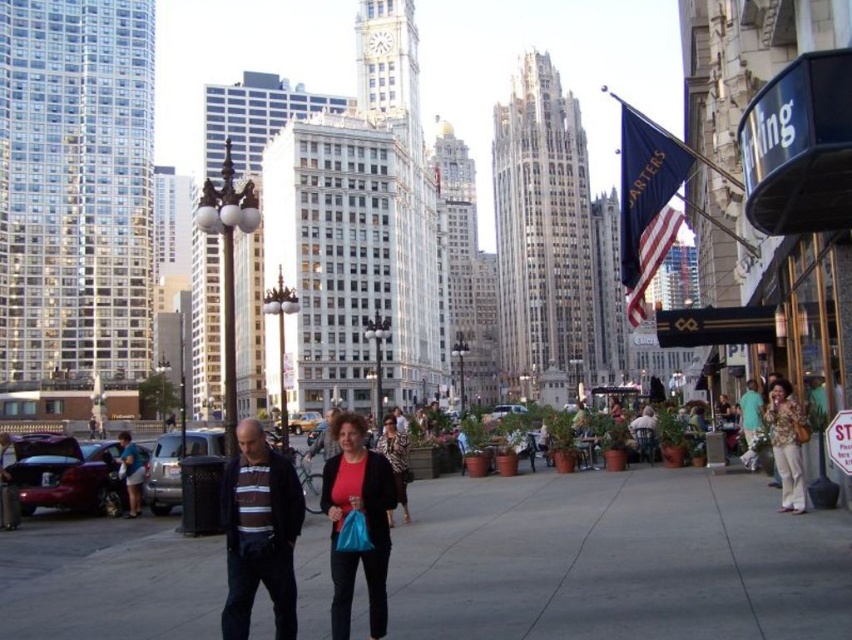
You are standing in the city square and want to walk towards the point at coordinates (320,449). There is another point at (348,577) in front of it. Which point should you aim for to reach your destination?

You should aim for the point at (320,449) because the point at (348,577) is in front of it, meaning it is closer to your current position. To reach your destination, you need to move past the point at (348,577) towards the point at (320,449).

You are a photographer trying to capture a photo of the striped sweater at center without the matte red shirt at center blocking it. What should you do?

Move the matte red shirt at center to the side so it is no longer in front of the striped sweater at center.

In the scene shown: You are a photographer positioned at the edge of the square, aiming to capture a photo of the two people in the center. Since you want to ensure the matte red shirt at center and the striped sweater at center are both clearly visible, which person should you focus on first to account for their height difference?

The matte red shirt at center is taller than the striped sweater at center, so you should focus on the matte red shirt at center first to ensure proper focus and visibility.